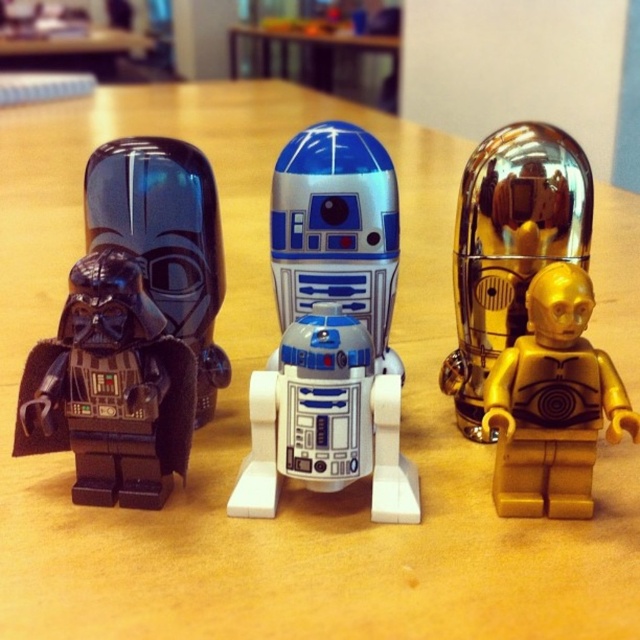
Is point (496, 148) in front of point (33, 42)?

Yes.

Is point (468, 346) positioned after point (4, 61)?

That is False.

Is point (474, 308) positioned behind point (44, 56)?

No, (474, 308) is in front of (44, 56).

Where is `gold reflective dome at center`? gold reflective dome at center is located at coordinates (509, 246).

The width and height of the screenshot is (640, 640). I want to click on white plastic robot at center, so click(x=324, y=420).

How far apart are white plastic robot at center and gold metallic figure at right?

white plastic robot at center and gold metallic figure at right are 8.17 inches apart from each other.

Is point (308, 376) less distant than point (525, 394)?

That is True.

Locate an element on the screen. white plastic robot at center is located at coordinates (324, 420).

Is gold metallic figure at right above wooden table at center?

Incorrect, gold metallic figure at right is not positioned above wooden table at center.

Is gold metallic figure at right shorter than wooden table at center?

In fact, gold metallic figure at right may be taller than wooden table at center.

Between point (545, 328) and point (12, 60), which one is positioned behind?

Point (12, 60)

At what (x,y) coordinates should I click in order to perform the action: click on gold metallic figure at right. Please return your answer as a coordinate pair (x, y). The width and height of the screenshot is (640, 640). Looking at the image, I should click on (552, 403).